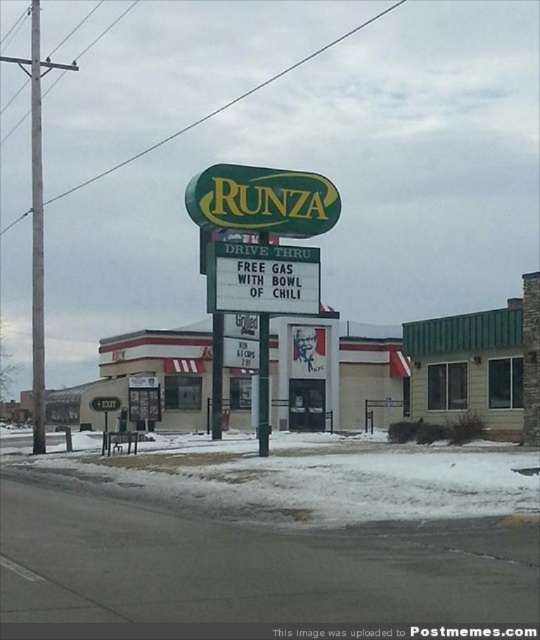
Question: Among these objects, which one is nearest to the camera?

Choices:
 (A) green plastic sign at upper center
 (B) white paper sign at center

Answer: (B)

Question: Observing the image, what is the correct spatial positioning of green plastic sign at upper center in reference to white paper sign at center?

Choices:
 (A) left
 (B) right

Answer: (A)

Question: Does green plastic sign at upper center have a larger size compared to white paper sign at center?

Choices:
 (A) yes
 (B) no

Answer: (A)

Question: Among these objects, which one is farthest from the camera?

Choices:
 (A) green plastic sign at upper center
 (B) white powdery snow at lower center
 (C) white paper sign at center

Answer: (A)

Question: Is white powdery snow at lower center closer to the viewer compared to white paper sign at center?

Choices:
 (A) no
 (B) yes

Answer: (B)

Question: Among these points, which one is nearest to the camera?

Choices:
 (A) (210, 227)
 (B) (221, 259)

Answer: (B)